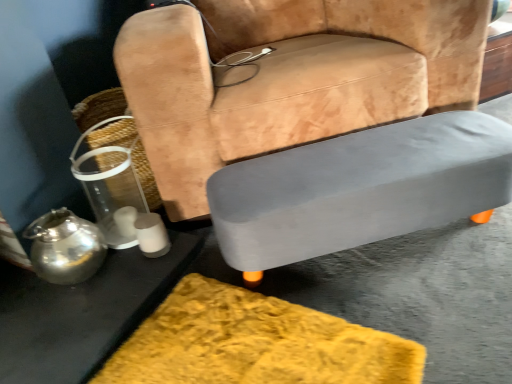
I want to click on vacant space to the left of shiny metallic teapot at lower left, so 18,297.